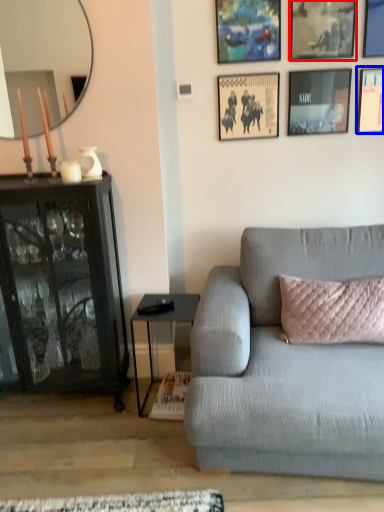
Question: Which object is further to the camera taking this photo, picture frame (highlighted by a red box) or picture frame (highlighted by a blue box)?

Choices:
 (A) picture frame
 (B) picture frame

Answer: (B)